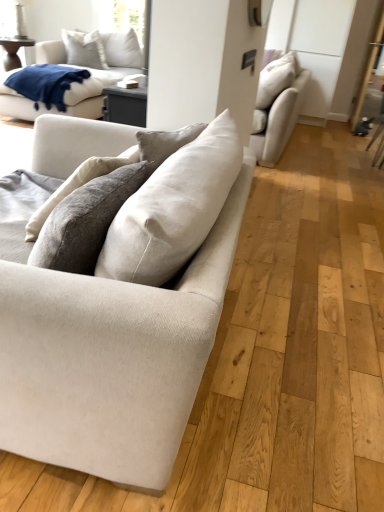
Question: Is beige fabric couch at center, arranged as the first studio couch when ordered from the bottom, facing away from white cotton pillow at upper left?

Choices:
 (A) yes
 (B) no

Answer: (B)

Question: Considering the relative positions of beige fabric couch at center, the 2th studio couch when ordered from right to left, and white cotton pillow at upper left in the image provided, is beige fabric couch at center, the 2th studio couch when ordered from right to left, to the left of white cotton pillow at upper left from the viewer's perspective?

Choices:
 (A) yes
 (B) no

Answer: (B)

Question: Is beige fabric couch at center, which is counted as the 2th studio couch, starting from the top, not near white cotton pillow at upper left?

Choices:
 (A) no
 (B) yes

Answer: (B)

Question: Considering the relative positions of beige fabric couch at center, arranged as the first studio couch when ordered from the bottom, and white cotton pillow at upper left in the image provided, is beige fabric couch at center, arranged as the first studio couch when ordered from the bottom, behind white cotton pillow at upper left?

Choices:
 (A) yes
 (B) no

Answer: (B)

Question: Is beige fabric couch at center, the 1th studio couch viewed from the left, located outside white cotton pillow at upper left?

Choices:
 (A) yes
 (B) no

Answer: (A)

Question: Is beige fabric couch at center, arranged as the first studio couch when ordered from the bottom, to the right of white cotton pillow at upper left from the viewer's perspective?

Choices:
 (A) yes
 (B) no

Answer: (A)

Question: Could you tell me if beige fabric couch at center, which is counted as the 2th studio couch, starting from the top, is turned towards blue soft fabric blanket at upper left?

Choices:
 (A) no
 (B) yes

Answer: (A)

Question: Can you see beige fabric couch at center, the 2th studio couch when ordered from right to left, touching blue soft fabric blanket at upper left?

Choices:
 (A) no
 (B) yes

Answer: (A)

Question: Is beige fabric couch at center, which is counted as the 2th studio couch, starting from the top, bigger than blue soft fabric blanket at upper left?

Choices:
 (A) yes
 (B) no

Answer: (A)

Question: From a real-world perspective, is beige fabric couch at center, the 2th studio couch when ordered from right to left, below blue soft fabric blanket at upper left?

Choices:
 (A) yes
 (B) no

Answer: (B)

Question: Is beige fabric couch at center, placed as the first studio couch when sorted from front to back, further to camera compared to blue soft fabric blanket at upper left?

Choices:
 (A) yes
 (B) no

Answer: (B)

Question: Considering the relative sizes of beige fabric couch at center, the 1th studio couch viewed from the left, and blue soft fabric blanket at upper left in the image provided, is beige fabric couch at center, the 1th studio couch viewed from the left, taller than blue soft fabric blanket at upper left?

Choices:
 (A) no
 (B) yes

Answer: (B)

Question: Is white matte cabinet at upper right turned away from blue soft fabric blanket at upper left?

Choices:
 (A) no
 (B) yes

Answer: (A)